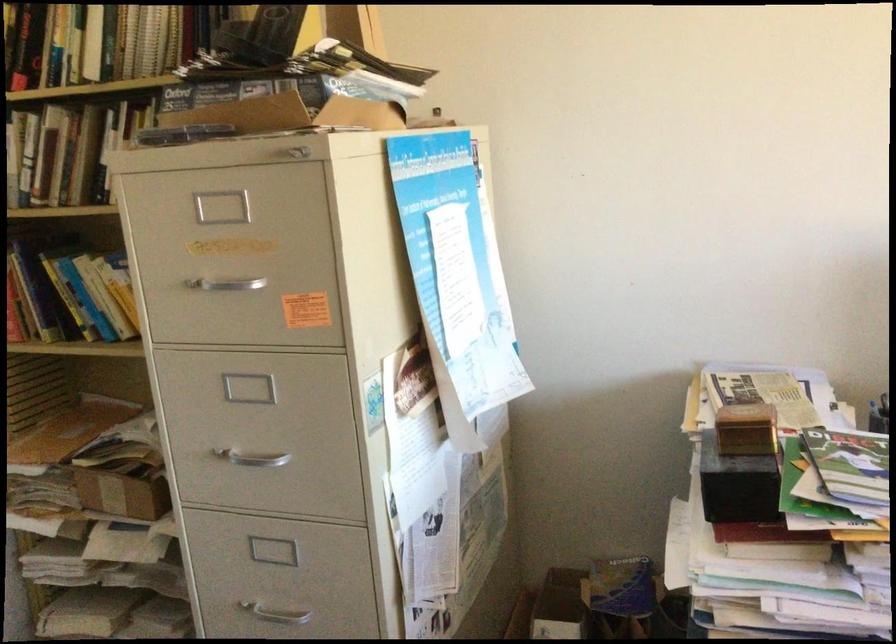
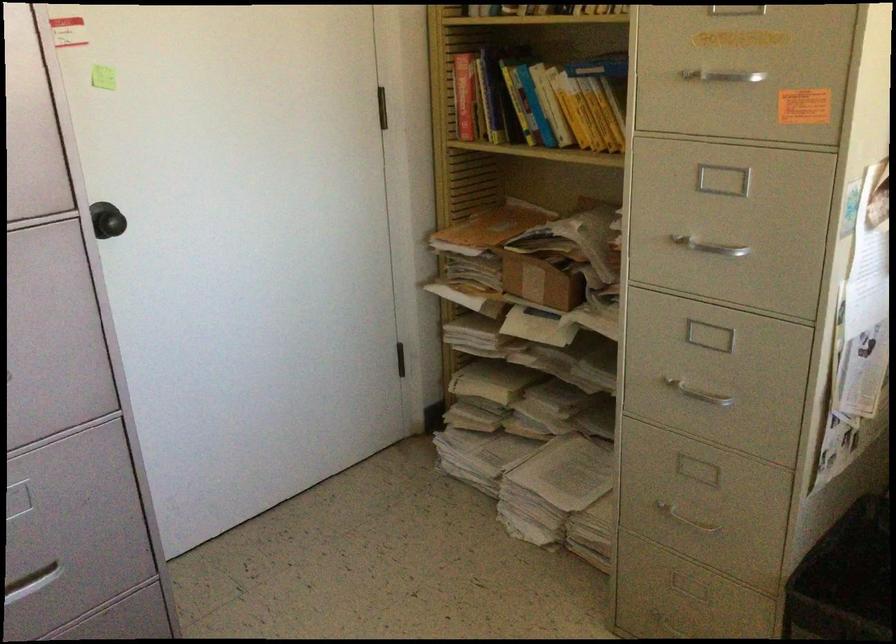
The point at (69,307) is marked in the first image. Where is the corresponding point in the second image?

(523, 111)